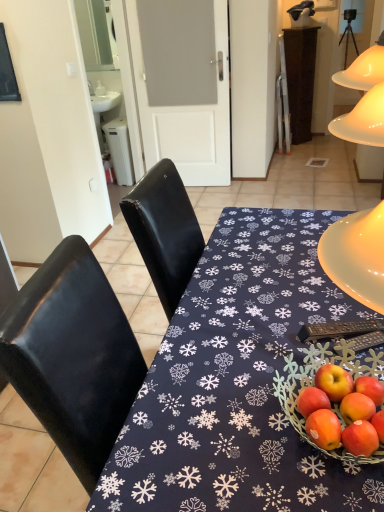
What do you see at coordinates (238, 383) in the screenshot? I see `matte black table at center` at bounding box center [238, 383].

Identify the location of matte black table at center. The width and height of the screenshot is (384, 512). (238, 383).

The image size is (384, 512). What do you see at coordinates (339, 330) in the screenshot? I see `black plastic remote control at lower right` at bounding box center [339, 330].

Where is `black plastic remote control at lower right`? black plastic remote control at lower right is located at coordinates (339, 330).

I want to click on matte black table at center, so click(238, 383).

Is black plastic remote control at lower right to the left or to the right of matte black table at center in the image?

In the image, black plastic remote control at lower right appears on the right side of matte black table at center.

Is black plastic remote control at lower right closer to the viewer compared to matte black table at center?

No, it is behind matte black table at center.

Is point (352, 322) farther from camera compared to point (289, 220)?

No, (352, 322) is closer to viewer.

From the image's perspective, is black plastic remote control at lower right located above or below matte black table at center?

black plastic remote control at lower right is above matte black table at center.

From a real-world perspective, is black plastic remote control at lower right above or below matte black table at center?

black plastic remote control at lower right is situated higher than matte black table at center in the real world.

Does black plastic remote control at lower right have a greater width compared to matte black table at center?

No.

Which of these two, black plastic remote control at lower right or matte black table at center, stands taller?

Answer: matte black table at center is taller.

Which of these two, black plastic remote control at lower right or matte black table at center, is smaller?

With smaller size is black plastic remote control at lower right.

Is matte black table at center located within black plastic remote control at lower right?

No, matte black table at center is not inside black plastic remote control at lower right.

Is black plastic remote control at lower right positioned far away from matte black table at center?

No, there isn't a large distance between black plastic remote control at lower right and matte black table at center.

Is black plastic remote control at lower right oriented towards matte black table at center?

Yes, black plastic remote control at lower right is facing matte black table at center.

What's the angular difference between black plastic remote control at lower right and matte black table at center's facing directions?

110 degrees separate the facing orientations of black plastic remote control at lower right and matte black table at center.

There is a matte black table at center. Where is `remote control above it (from a real-world perspective)`? Image resolution: width=384 pixels, height=512 pixels. remote control above it (from a real-world perspective) is located at coordinates (339, 330).

Based on the photo, is matte black table at center to the left or to the right of black plastic remote control at lower right in the image?

Clearly, matte black table at center is on the left of black plastic remote control at lower right in the image.

Which object is closer to the camera, matte black table at center or black plastic remote control at lower right?

matte black table at center is in front.

Considering the positions of points (281, 333) and (343, 337), is point (281, 333) closer to camera compared to point (343, 337)?

That is False.

From the image's perspective, is matte black table at center under black plastic remote control at lower right?

Correct, matte black table at center appears lower than black plastic remote control at lower right in the image.

From a real-world perspective, which object rests below the other?

matte black table at center is physically lower.

Consider the image. Between matte black table at center and black plastic remote control at lower right, which one has larger width?

Wider between the two is matte black table at center.

Consider the image. Does matte black table at center have a lesser height compared to black plastic remote control at lower right?

In fact, matte black table at center may be taller than black plastic remote control at lower right.

Considering the sizes of matte black table at center and black plastic remote control at lower right in the image, is matte black table at center bigger or smaller than black plastic remote control at lower right?

Clearly, matte black table at center is larger in size than black plastic remote control at lower right.

Is black plastic remote control at lower right surrounded by matte black table at center?

That's correct, black plastic remote control at lower right is inside matte black table at center.

Can you see matte black table at center touching black plastic remote control at lower right?

No, matte black table at center is not beside black plastic remote control at lower right.

Is matte black table at center positioned with its back to black plastic remote control at lower right?

No.

What's the angular difference between matte black table at center and black plastic remote control at lower right's facing directions?

There is a 110-degree angle between the facing directions of matte black table at center and black plastic remote control at lower right.

Measure the distance between matte black table at center and black plastic remote control at lower right.

The distance of matte black table at center from black plastic remote control at lower right is 12.51 inches.

This screenshot has height=512, width=384. Identify the location of desk in front of the black plastic remote control at lower right. (238, 383).

What are the coordinates of `remote control that is above the matte black table at center (from a real-world perspective)` in the screenshot? It's located at (339, 330).

Find the location of `remote control located behind the matte black table at center`. remote control located behind the matte black table at center is located at coordinates (339, 330).